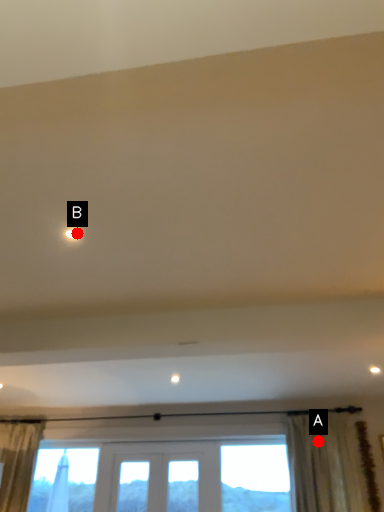
Question: Two points are circled on the image, labeled by A and B beside each circle. Which point is closer to the camera?

Choices:
 (A) A is closer
 (B) B is closer

Answer: (B)